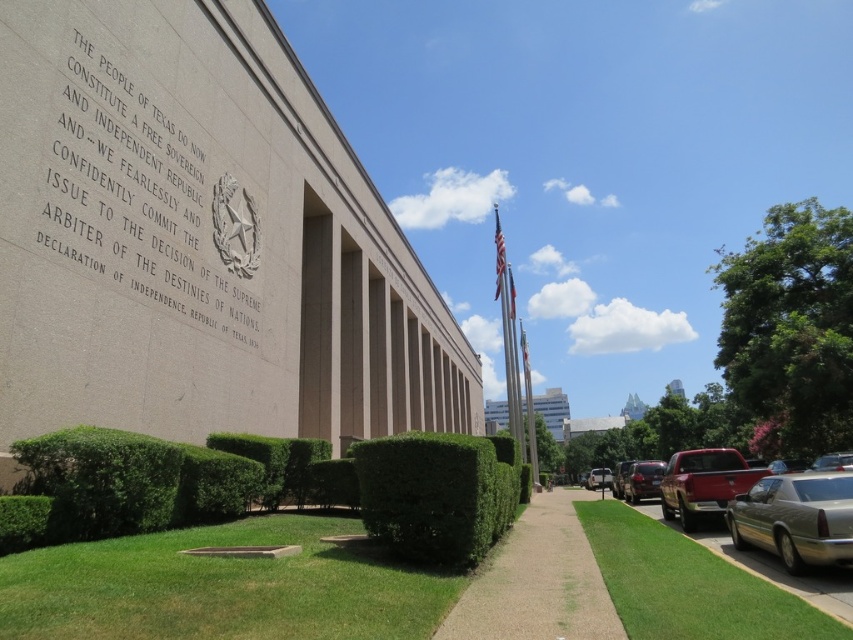
You are standing in front of the beige building and notice two points marked on the facade. The first point is at coordinates point (x=550, y=512) and the second at point (x=630, y=474). Which of these points is closer to you?

Point (x=550, y=512) is in front of point (x=630, y=474), so it is closer to you.

You are standing in front of the building and notice two points marked on the facade. The first point is at coordinate point [338,616] and the second is at point [827,524]. Which point is closer to you?

Point [338,616] is closer to the viewer than point [827,524].